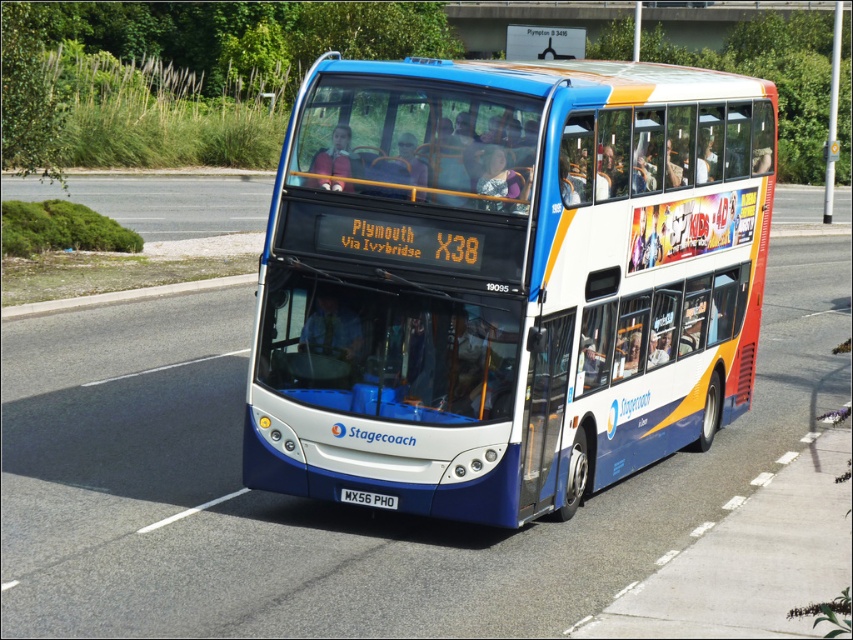
You are a passenger on the blue metallic bus at center. You want to get off at the next stop, but you need to press the button located at point [505,280]. Is the button within your reach from your current seat?

The blue metallic bus at center is located at point [505,280], so the button is exactly at that point. If your seat is near that location, you can reach it. However, if you are seated far away, you might need to ask someone nearby to press it for you.

You are a pedestrian standing on the sidewalk. You see the blue metallic bus at center and the white plastic license plate at center. Which object is nearer to you?

The blue metallic bus at center is closer to the viewer than the white plastic license plate at center.